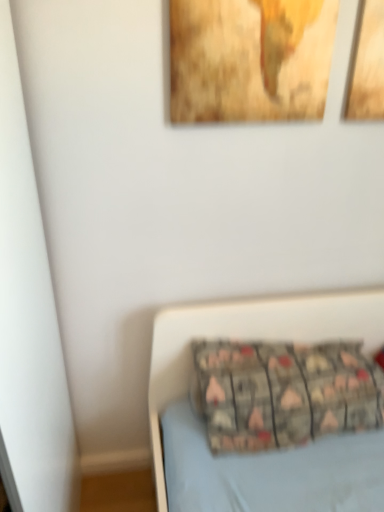
Question: From the image's perspective, is wooden textured picture frame at upper center over patterned fabric pillow at lower center?

Choices:
 (A) no
 (B) yes

Answer: (B)

Question: Does wooden textured picture frame at upper center have a greater height compared to patterned fabric pillow at lower center?

Choices:
 (A) no
 (B) yes

Answer: (B)

Question: From a real-world perspective, is wooden textured picture frame at upper center positioned under patterned fabric pillow at lower center based on gravity?

Choices:
 (A) yes
 (B) no

Answer: (B)

Question: Would you consider wooden textured picture frame at upper center to be distant from patterned fabric pillow at lower center?

Choices:
 (A) no
 (B) yes

Answer: (A)

Question: Is wooden textured picture frame at upper center facing towards patterned fabric pillow at lower center?

Choices:
 (A) no
 (B) yes

Answer: (A)

Question: Is wooden textured picture frame at upper center in front of patterned fabric pillow at lower center?

Choices:
 (A) no
 (B) yes

Answer: (B)

Question: Is the position of patterned fabric pillow at lower center more distant than that of wooden textured picture frame at upper center?

Choices:
 (A) no
 (B) yes

Answer: (B)

Question: From the image's perspective, is patterned fabric pillow at lower center under wooden textured picture frame at upper center?

Choices:
 (A) yes
 (B) no

Answer: (A)

Question: Is patterned fabric pillow at lower center positioned far away from wooden textured picture frame at upper center?

Choices:
 (A) yes
 (B) no

Answer: (B)

Question: Is wooden textured picture frame at upper center surrounded by patterned fabric pillow at lower center?

Choices:
 (A) no
 (B) yes

Answer: (A)

Question: Is patterned fabric pillow at lower center to the right of wooden textured picture frame at upper center from the viewer's perspective?

Choices:
 (A) no
 (B) yes

Answer: (B)

Question: From the image's perspective, is patterned fabric pillow at lower center on wooden textured picture frame at upper center?

Choices:
 (A) no
 (B) yes

Answer: (A)

Question: Choose the correct answer: Is patterned fabric pillow at lower center inside wooden textured picture frame at upper center or outside it?

Choices:
 (A) inside
 (B) outside

Answer: (B)